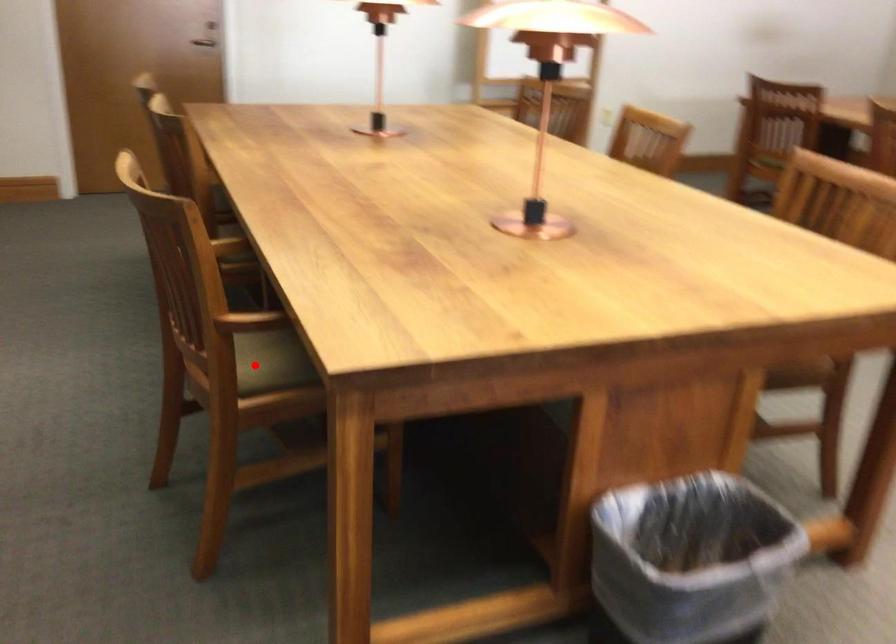
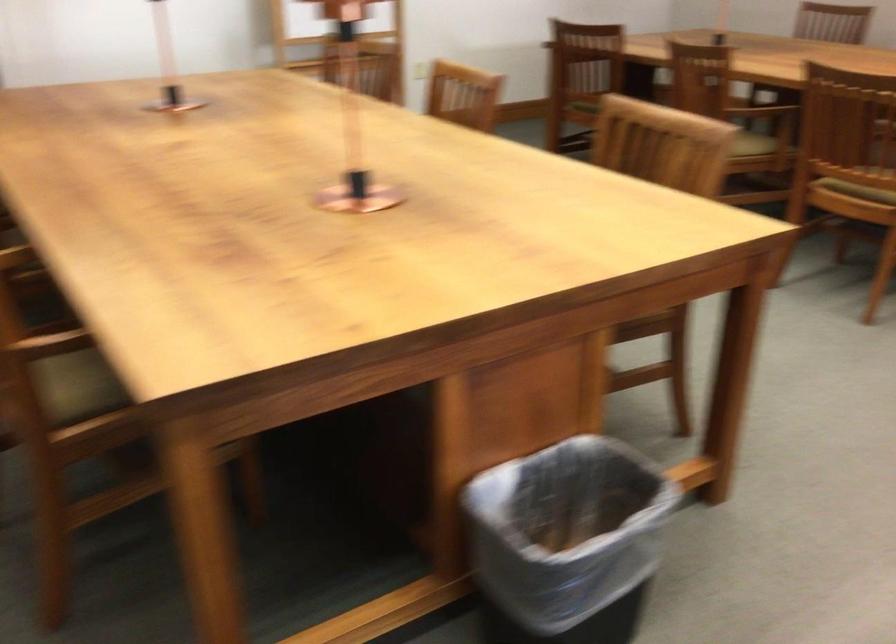
Question: I am providing you with two images of the same scene from different viewpoints. A red point is shown in image1. For the corresponding object point in image2, is it positioned nearer or farther from the camera?

Choices:
 (A) Nearer
 (B) Farther

Answer: (A)